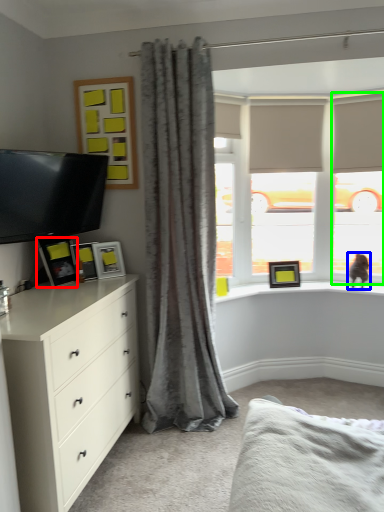
Question: Which is nearer to the picture frame (highlighted by a red box)? cat (highlighted by a blue box) or glass door (highlighted by a green box).

Choices:
 (A) cat
 (B) glass door

Answer: (A)